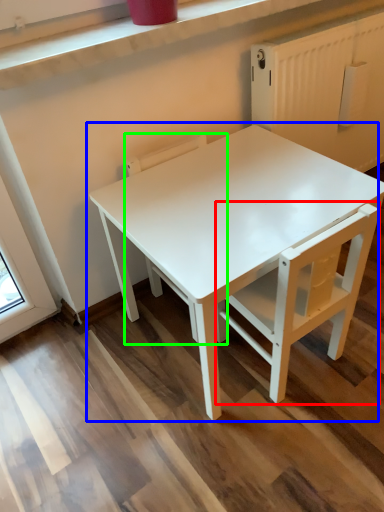
Question: Which object is positioned farthest from chair (highlighted by a red box)? Select from table (highlighted by a blue box) and chair (highlighted by a green box).

Choices:
 (A) table
 (B) chair

Answer: (B)